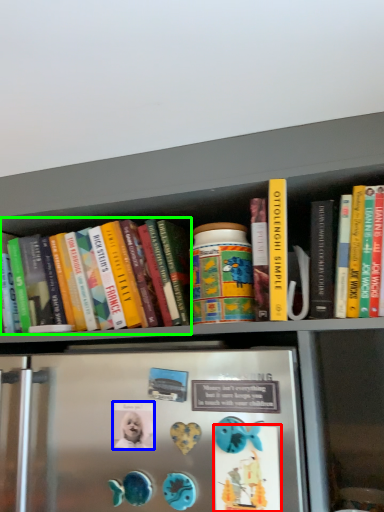
Question: Which is farther away from button (highlighted by a red box)? button (highlighted by a blue box) or book (highlighted by a green box)?

Choices:
 (A) button
 (B) book

Answer: (B)